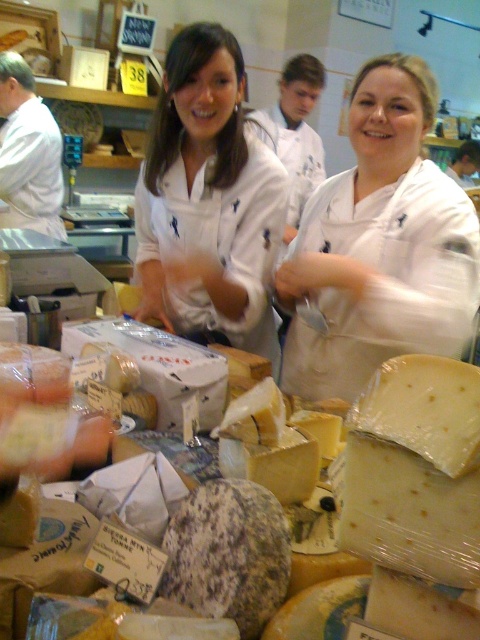
Based on the photo, you are a customer in the cheese shop and want to know which item is narrower between the white matte apron at center and the white matte uniform at center. Which one is narrower?

The white matte apron at center is narrower than the white matte uniform at center.

You are a customer in the cheese shop and want to know which item is larger between the white matte apron at center and the white matte uniform at center. Which one is bigger?

The white matte apron at center is bigger than the white matte uniform at center.